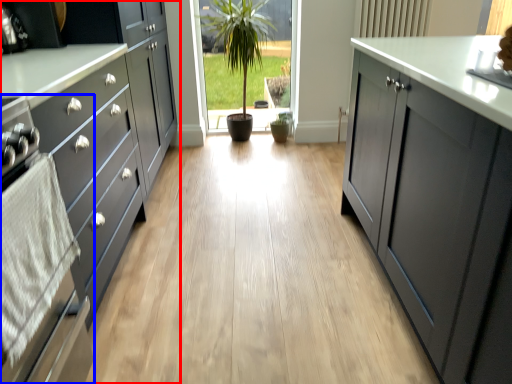
Question: Which object is further to the camera taking this photo, cabinetry (highlighted by a red box) or oven (highlighted by a blue box)?

Choices:
 (A) cabinetry
 (B) oven

Answer: (A)